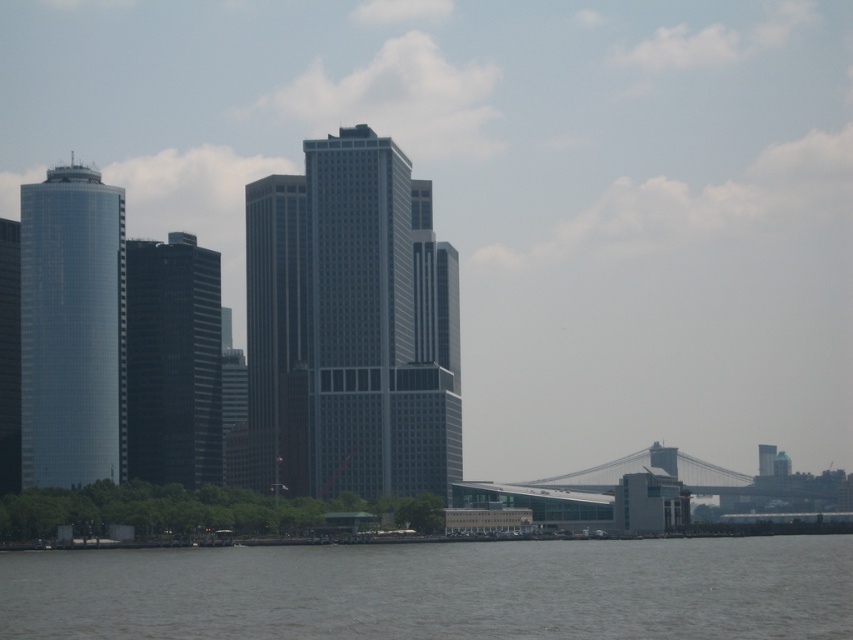
Does gray water at lower center have a greater height compared to gray glass skyscraper at center?

In fact, gray water at lower center may be shorter than gray glass skyscraper at center.

Is point (747, 556) closer to camera compared to point (364, 166)?

No, (747, 556) is behind (364, 166).

Locate an element on the screen. The width and height of the screenshot is (853, 640). gray water at lower center is located at coordinates (438, 589).

Who is lower down, gray glass skyscraper at center or shiny glass tower at left?

Positioned lower is shiny glass tower at left.

This screenshot has height=640, width=853. I want to click on gray glass skyscraper at center, so click(x=351, y=326).

I want to click on gray glass skyscraper at center, so click(x=351, y=326).

Can you confirm if gray water at lower center is thinner than black glass building at center-left?

Incorrect, gray water at lower center's width is not less than black glass building at center-left's.

Is point (15, 637) less distant than point (137, 320)?

No, (15, 637) is further to viewer.

Between point (529, 580) and point (126, 397), which one is positioned in front?

Point (529, 580) is more forward.

The image size is (853, 640). Find the location of `gray water at lower center`. gray water at lower center is located at coordinates (438, 589).